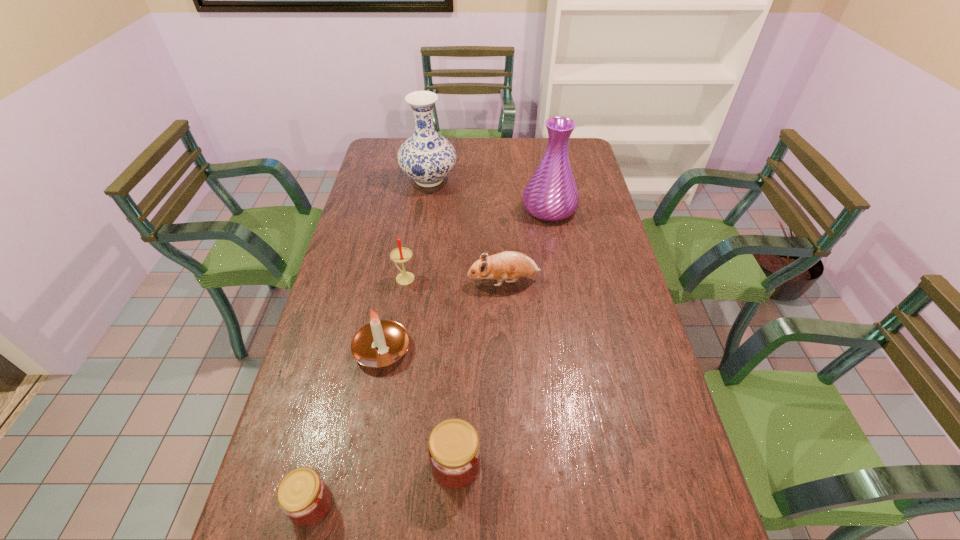
This screenshot has height=540, width=960. In order to click on free space located on the front of the farther candle in this screenshot , I will do `click(400, 306)`.

I want to click on free space located 0.140m on the right of the left vase, so click(x=492, y=180).

Identify the location of blank space located 0.270m on the front of the fifth farthest object. (358, 481).

This screenshot has width=960, height=540. What are the coordinates of `vacant space located on the left of the right vase` in the screenshot? It's located at (497, 208).

Identify the location of blank space located 0.220m at the face of the hamster. (397, 281).

At what (x,y) coordinates should I click in order to perform the action: click on free space located at the face of the hamster. Please return your answer as a coordinate pair (x, y). The height and width of the screenshot is (540, 960). Looking at the image, I should click on (360, 281).

Identify the location of vacant space located 0.300m at the face of the hamster. This screenshot has height=540, width=960. (372, 281).

Where is `object that is positioned at the far edge`? The image size is (960, 540). object that is positioned at the far edge is located at coordinates (426, 157).

Locate an element on the screen. This screenshot has height=540, width=960. jam present at the left edge is located at coordinates (303, 496).

Locate an element on the screen. The image size is (960, 540). vase located in the left edge section of the desktop is located at coordinates (426, 157).